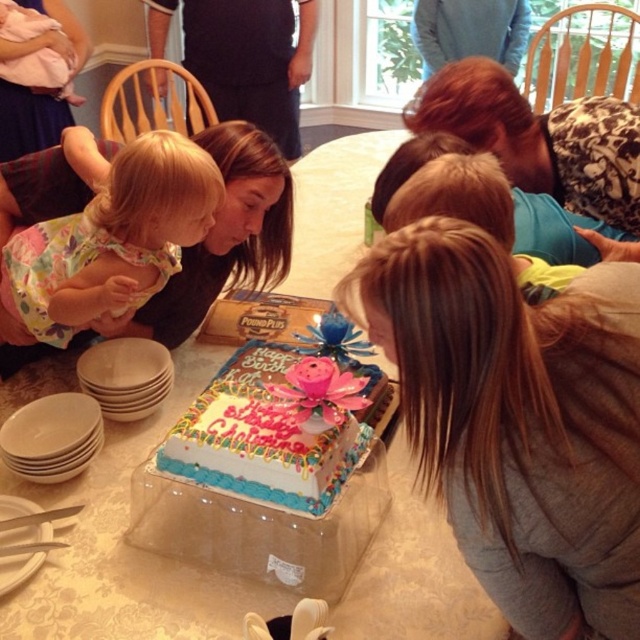
Question: Where is leopard print shirt at center located in relation to decorative frosted cake at center in the image?

Choices:
 (A) right
 (B) left

Answer: (A)

Question: Does brown textured sweater at center appear under leopard print shirt at center?

Choices:
 (A) yes
 (B) no

Answer: (A)

Question: Can you confirm if brown textured sweater at center is thinner than decorative frosted cake at center?

Choices:
 (A) yes
 (B) no

Answer: (B)

Question: Which point is farther from the camera taking this photo?

Choices:
 (A) (147, 208)
 (B) (636, 221)
 (C) (307, 433)

Answer: (B)

Question: Which of these objects is positioned closest to the leopard print shirt at center?

Choices:
 (A) decorative frosted cake at center
 (B) brown textured sweater at center
 (C) floral dress at left

Answer: (B)

Question: Which point is closer to the camera taking this photo?

Choices:
 (A) (611, 113)
 (B) (228, 448)

Answer: (B)